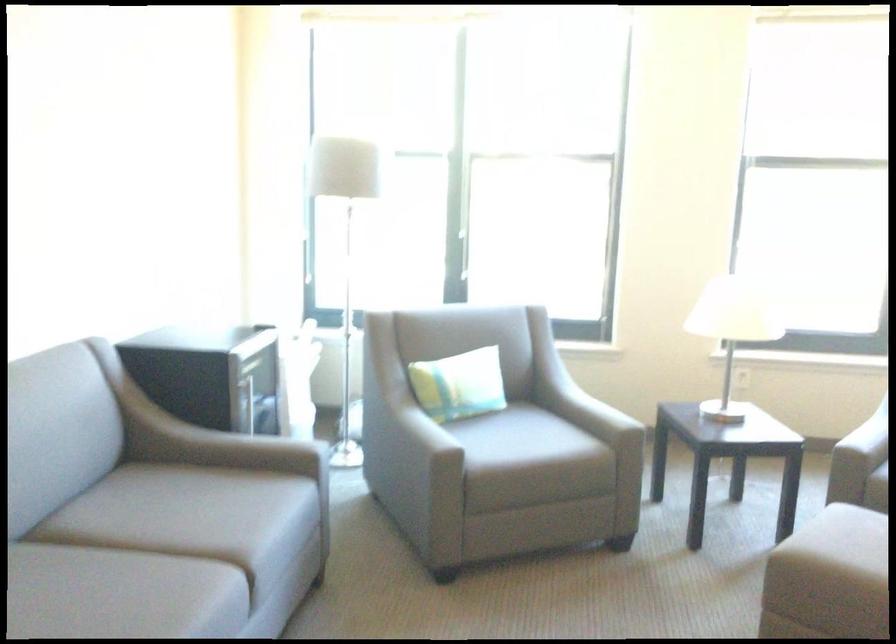
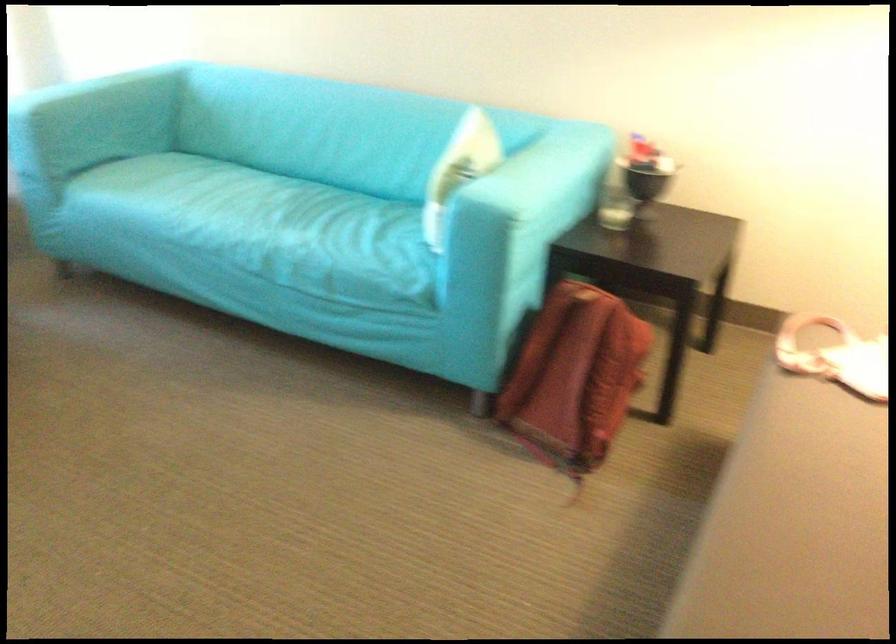
The images are taken continuously from a first-person perspective. In which direction is your viewpoint rotating?

The camera's rotation is toward right-down.